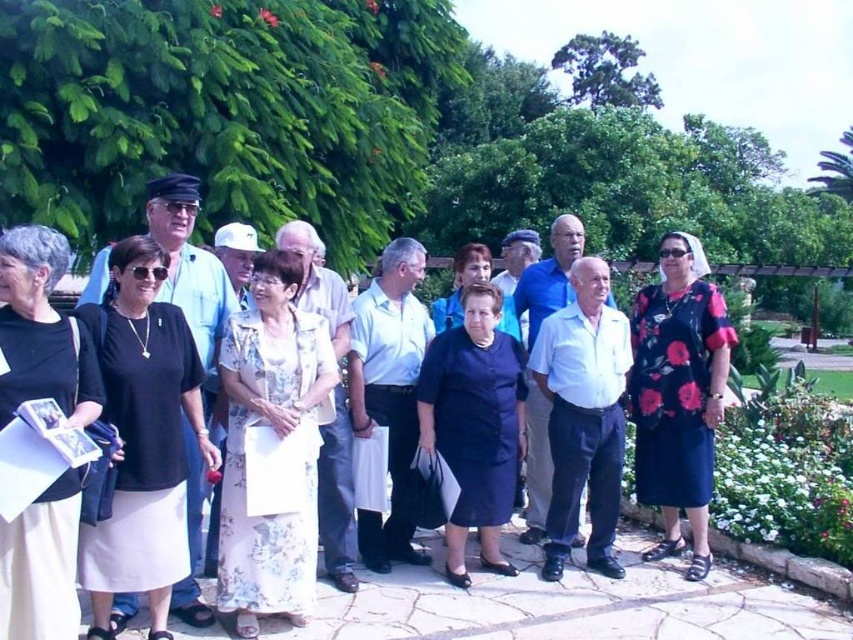
Can you confirm if floral fabric dress at center is shorter than floral-patterned dress at center?

Indeed, floral fabric dress at center has a lesser height compared to floral-patterned dress at center.

Is floral fabric dress at center below floral-patterned dress at center?

Yes, floral fabric dress at center is below floral-patterned dress at center.

Between point (299, 328) and point (686, 304), which one is positioned in front?

Point (299, 328) is in front.

Where is `floral fabric dress at center`? floral fabric dress at center is located at coordinates (273, 436).

Who is higher up, floral-patterned dress at center or dark blue fabric dress at center?

floral-patterned dress at center is above.

Can you confirm if floral-patterned dress at center is thinner than dark blue fabric dress at center?

Indeed, floral-patterned dress at center has a lesser width compared to dark blue fabric dress at center.

Between point (663, 456) and point (451, 467), which one is positioned behind?

Positioned behind is point (663, 456).

This screenshot has width=853, height=640. Identify the location of floral-patterned dress at center. (677, 394).

Which is below, floral fabric dress at center or black satin skirt at lower left?

Positioned lower is floral fabric dress at center.

Between floral fabric dress at center and black satin skirt at lower left, which one appears on the left side from the viewer's perspective?

black satin skirt at lower left is more to the left.

In order to click on floral fabric dress at center in this screenshot , I will do `click(273, 436)`.